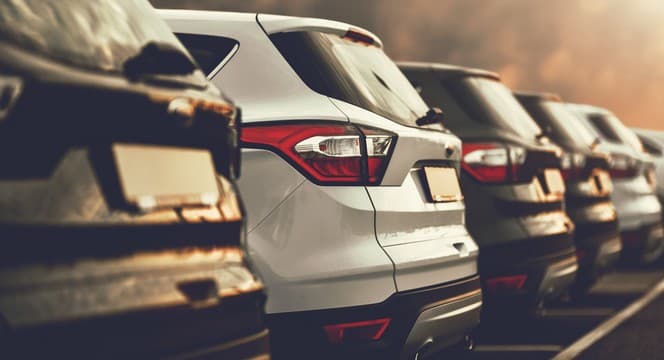
Find the location of `back window`. back window is located at coordinates (102, 41), (348, 72), (500, 110), (578, 123), (613, 128).